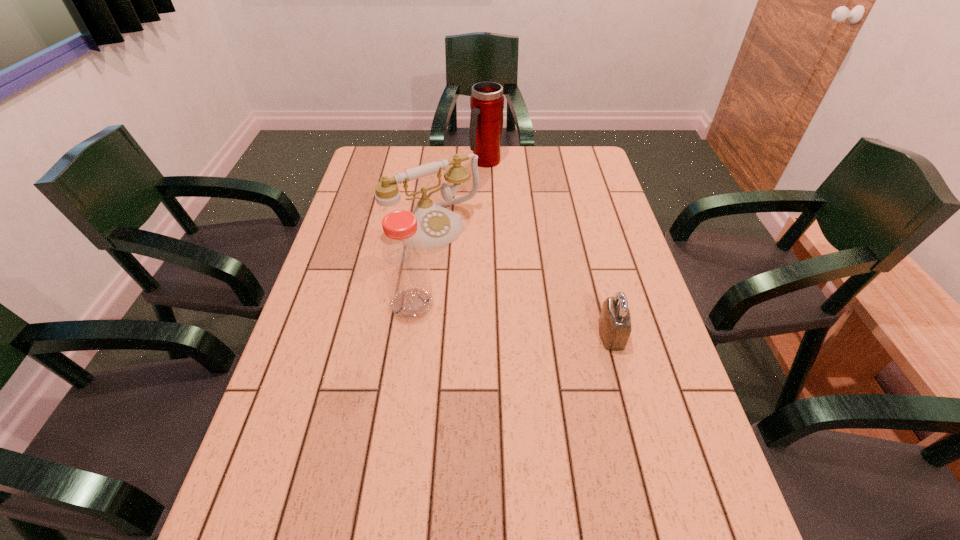
Identify the location of free point located 0.180m on the dial of the second shortest object. The height and width of the screenshot is (540, 960). (488, 284).

The height and width of the screenshot is (540, 960). I want to click on blank space located on the dial of the second shortest object, so click(x=478, y=273).

Identify the location of vacant space located 0.360m on the dial of the second shortest object. Image resolution: width=960 pixels, height=540 pixels. (526, 328).

Locate an element on the screen. object positioned at the far edge is located at coordinates (487, 101).

Where is `object that is at the left edge`? object that is at the left edge is located at coordinates (438, 226).

I want to click on object situated at the right edge, so click(x=614, y=321).

At what (x,y) coordinates should I click in order to perform the action: click on vacant space at the far edge. Please return your answer as a coordinate pair (x, y). This screenshot has height=540, width=960. Looking at the image, I should click on (514, 177).

In the image, there is a desktop. At what (x,y) coordinates should I click in order to perform the action: click on free region at the near edge. Please return your answer as a coordinate pair (x, y). Looking at the image, I should click on (455, 459).

You are a GUI agent. You are given a task and a screenshot of the screen. Output one action in this format:
    pyautogui.click(x=<x>, y=<y>)
    Task: Click on the vacant space at the left edge of the desktop
    This screenshot has width=960, height=540.
    Given the screenshot: What is the action you would take?
    pyautogui.click(x=324, y=444)

Locate an element on the screen. vacant position at the right edge of the desktop is located at coordinates (586, 217).